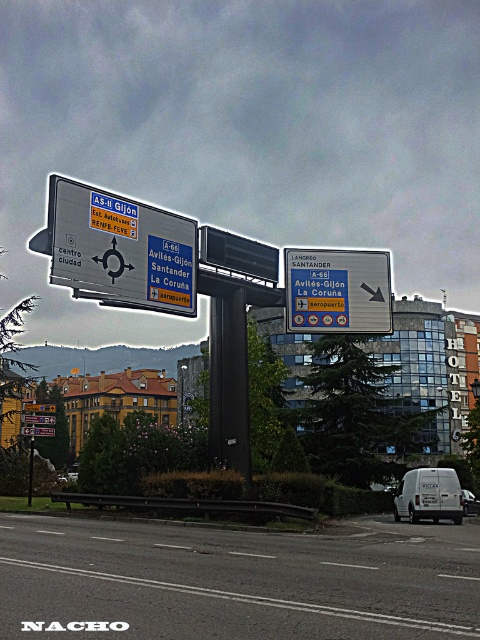
You are a delivery driver approaching the intersection and need to see the blue plastic sign at center to navigate. However, the white matte van at center is blocking your view. Can you see the sign over the van?

The blue plastic sign at center is located above the white matte van at center, so yes, you can see the sign over the van.

You are a delivery driver approaching the intersection and need to decide whether your truck, which is as wide as the white matte van at lower right, can safely pass through the space next to the blue plastic sign at center. Can your truck fit through without hitting the sign?

The blue plastic sign at center is wider than the white matte van at lower right. Since your truck is as wide as the van, it should be able to pass through the space next to the blue plastic sign at center without hitting it, as the sign is wider, providing enough clearance.